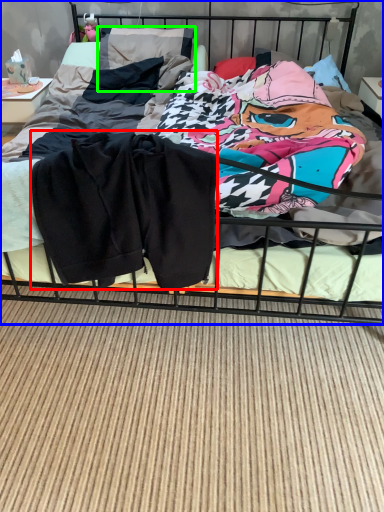
Question: Which object is positioned farthest from baby clothe (highlighted by a red box)? Select from bed (highlighted by a blue box) and pillow (highlighted by a green box).

Choices:
 (A) bed
 (B) pillow

Answer: (A)